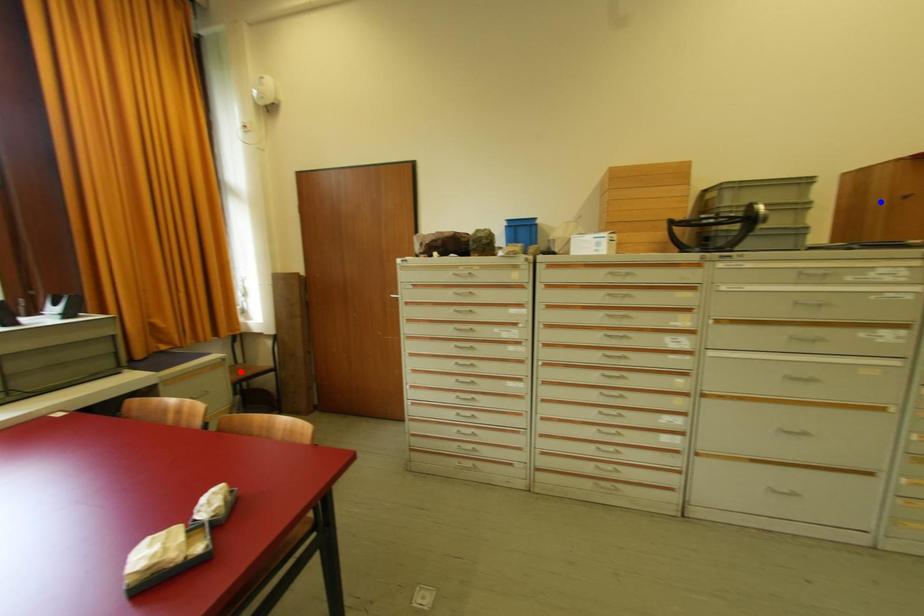
Question: Which of the two points in the image is closer to the camera?

Choices:
 (A) Blue point is closer.
 (B) Red point is closer.

Answer: (A)